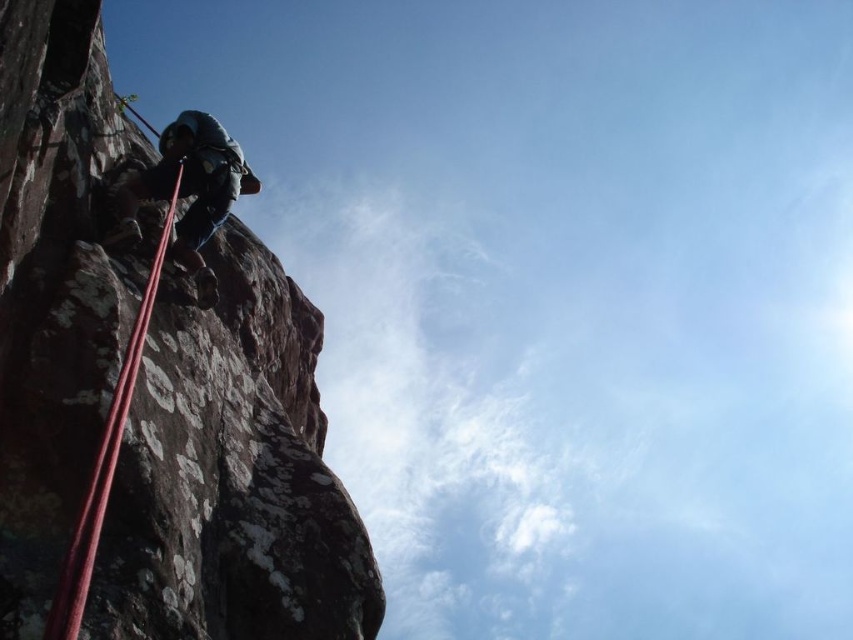
As a safety inspector reviewing this climbing scene, you need to ensure the climber is properly anchored. The brown rough rock at left and the dark blue fabric climbing harness at left are both visible in your view. Which object is positioned lower in the image?

The brown rough rock at left is below the dark blue fabric climbing harness at left, so the brown rough rock at left is positioned lower in the image.

You are a rock climber planning to ascend the rock face. You notice the brown rough rock at left and the red nylon rope at left. Which object is taller and could potentially block your path?

The brown rough rock at left is much taller than the red nylon rope at left, so it could potentially block your path.

You are a safety inspector checking the climbing setup. The safety regulations require that the distance between the dark blue fabric climbing harness at left and the red nylon rope at left must not exceed 5 meters. Is the current setup compliant with the safety regulations?

The dark blue fabric climbing harness at left and the red nylon rope at left are 5.11 meters apart, which exceeds the 5 meter limit. The setup is not compliant with the safety regulations.